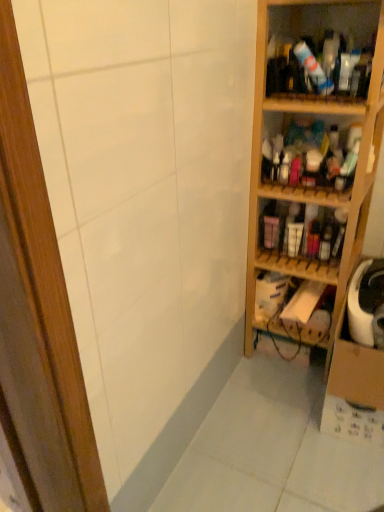
Question: Looking at the image, does wooden shelves at right, which appears as the second shelf when viewed from the top, seem bigger or smaller compared to matte plastic bottles at center right, which appears as the fourth shelf when viewed from the top?

Choices:
 (A) big
 (B) small

Answer: (A)

Question: Is wooden shelves at right, the 4th shelf in the bottom-to-top sequence, spatially inside matte plastic bottles at center right, which appears as the fourth shelf when viewed from the top, or outside of it?

Choices:
 (A) inside
 (B) outside

Answer: (B)

Question: Estimate the real-world distances between objects in this image. Which object is closer to the wooden shelf at right, the 3th shelf in the top-to-bottom sequence?

Choices:
 (A) wooden shelf at right, which is counted as the 1th shelf, starting from the bottom
 (B) translucent plastic bottles at upper right, which is counted as the fifth shelf, starting from the bottom
 (C) matte plastic bottles at center right, which appears as the fourth shelf when viewed from the top
 (D) wooden shelves at right, the 4th shelf in the bottom-to-top sequence

Answer: (D)

Question: Based on their relative distances, which object is farther from the matte plastic bottles at center right, which appears as the fourth shelf when viewed from the top?

Choices:
 (A) wooden shelf at right, positioned as the third shelf in bottom-to-top order
 (B) translucent plastic bottles at upper right, arranged as the 1th shelf when viewed from the top
 (C) wooden shelf at right, marked as the fifth shelf in a top-to-bottom arrangement
 (D) wooden shelves at right, which appears as the second shelf when viewed from the top

Answer: (B)